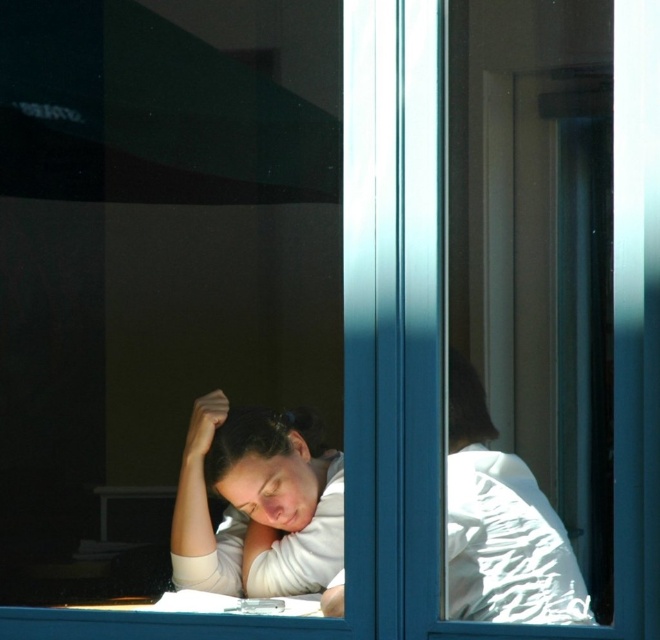
Between white matte shirt at center and smooth brown hair at center, which one is positioned lower?

white matte shirt at center is below.

Who is shorter, white matte shirt at center or smooth brown hair at center?

smooth brown hair at center

Which is behind, point (581, 596) or point (451, 433)?

The point (451, 433) is behind.

Identify the location of white matte shirt at center. The width and height of the screenshot is (660, 640). (502, 525).

Between white matte shirt at center and matte white head at lower center, which one has less height?

matte white head at lower center

Image resolution: width=660 pixels, height=640 pixels. I want to click on white matte shirt at center, so click(502, 525).

Is point (461, 564) positioned behind point (300, 504)?

That is False.

Where is `white matte shirt at center`? This screenshot has width=660, height=640. white matte shirt at center is located at coordinates (502, 525).

Which is behind, point (213, 545) or point (214, 428)?

Point (214, 428)

Can you confirm if matte white shirt at center is positioned to the right of matte white head at lower center?

Incorrect, matte white shirt at center is not on the right side of matte white head at lower center.

Image resolution: width=660 pixels, height=640 pixels. What do you see at coordinates (257, 502) in the screenshot? I see `matte white shirt at center` at bounding box center [257, 502].

Find the location of `matte white shirt at center`. matte white shirt at center is located at coordinates [257, 502].